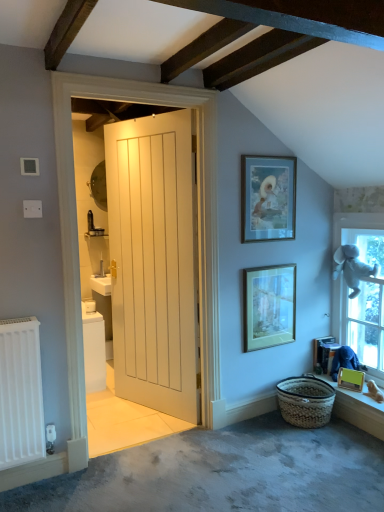
Question: Is matte glass picture frame at center, the second picture frame from the bottom, outside wooden window sill at lower right?

Choices:
 (A) no
 (B) yes

Answer: (B)

Question: From the image's perspective, is matte glass picture frame at center, which is the 2th picture frame from right to left, above wooden window sill at lower right?

Choices:
 (A) yes
 (B) no

Answer: (A)

Question: Is there a large distance between matte glass picture frame at center, which is the second picture frame from left to right, and wooden window sill at lower right?

Choices:
 (A) yes
 (B) no

Answer: (B)

Question: Does matte glass picture frame at center, which is the 2th picture frame from right to left, turn towards wooden window sill at lower right?

Choices:
 (A) yes
 (B) no

Answer: (B)

Question: From a real-world perspective, is matte glass picture frame at center, which is the second picture frame from left to right, located beneath wooden window sill at lower right?

Choices:
 (A) yes
 (B) no

Answer: (B)

Question: Considering the positions of white wooden door at center and matte gold picture frame at upper center, which is the first picture frame in top-to-bottom order, in the image, is white wooden door at center taller or shorter than matte gold picture frame at upper center, which is the first picture frame in top-to-bottom order,?

Choices:
 (A) short
 (B) tall

Answer: (B)

Question: Is white wooden door at center wider or thinner than matte gold picture frame at upper center, placed as the third picture frame when sorted from bottom to top?

Choices:
 (A) wide
 (B) thin

Answer: (A)

Question: Would you say white wooden door at center is to the left or to the right of matte gold picture frame at upper center, which is the first picture frame in top-to-bottom order, in the picture?

Choices:
 (A) left
 (B) right

Answer: (A)

Question: Would you say white wooden door at center is inside or outside matte gold picture frame at upper center, placed as the first picture frame when sorted from left to right?

Choices:
 (A) inside
 (B) outside

Answer: (B)

Question: Is braided straw basket at lower right wider or thinner than white wooden door at center?

Choices:
 (A) thin
 (B) wide

Answer: (B)

Question: Is braided straw basket at lower right bigger or smaller than white wooden door at center?

Choices:
 (A) big
 (B) small

Answer: (B)

Question: Would you say braided straw basket at lower right is inside or outside white wooden door at center?

Choices:
 (A) inside
 (B) outside

Answer: (B)

Question: Relative to white wooden door at center, is braided straw basket at lower right in front or behind?

Choices:
 (A) front
 (B) behind

Answer: (B)

Question: Considering the positions of matte yellow picture frame at lower right, the 3th picture frame in the top-to-bottom sequence, and wooden window sill at lower right in the image, is matte yellow picture frame at lower right, the 3th picture frame in the top-to-bottom sequence, bigger or smaller than wooden window sill at lower right?

Choices:
 (A) big
 (B) small

Answer: (B)

Question: Do you think matte yellow picture frame at lower right, the 3th picture frame in the top-to-bottom sequence, is within wooden window sill at lower right, or outside of it?

Choices:
 (A) outside
 (B) inside

Answer: (A)